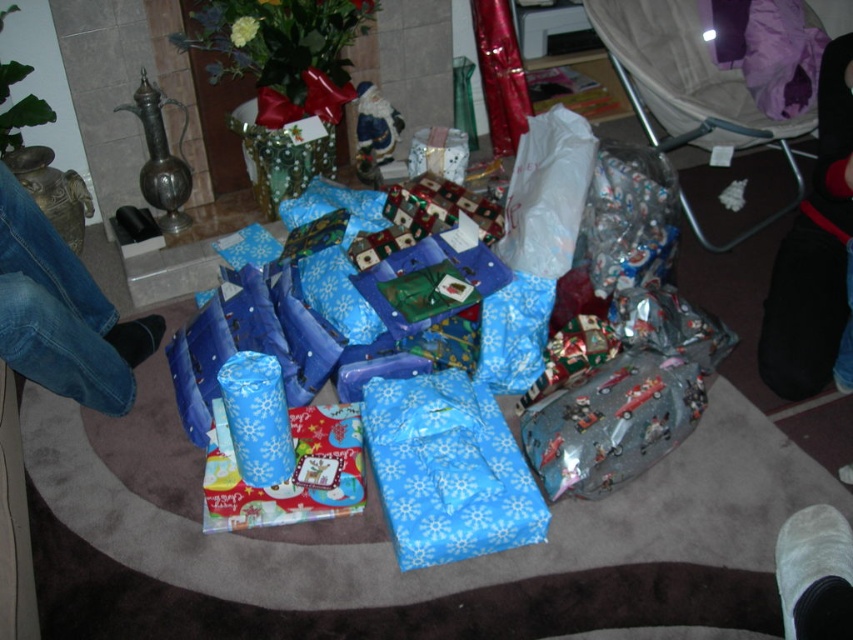
Question: Does blue paper wrapped gift at center lie in front of blue jeans at left?

Choices:
 (A) no
 (B) yes

Answer: (A)

Question: Does blue paper wrapped gift at center appear on the right side of blue jeans at left?

Choices:
 (A) no
 (B) yes

Answer: (B)

Question: Which object appears farthest from the camera in this image?

Choices:
 (A) blue fabric sock at lower left
 (B) blue paper wrapped gift at center
 (C) blue jeans at left

Answer: (A)

Question: Can you confirm if blue jeans at left is wider than blue fabric sock at lower left?

Choices:
 (A) yes
 (B) no

Answer: (A)

Question: Which of the following is the closest to the observer?

Choices:
 (A) blue jeans at left
 (B) blue paper wrapped gift at center
 (C) blue fabric sock at lower left

Answer: (A)

Question: Which point is farther to the camera?

Choices:
 (A) (12, 227)
 (B) (534, 484)
 (C) (137, 364)

Answer: (C)